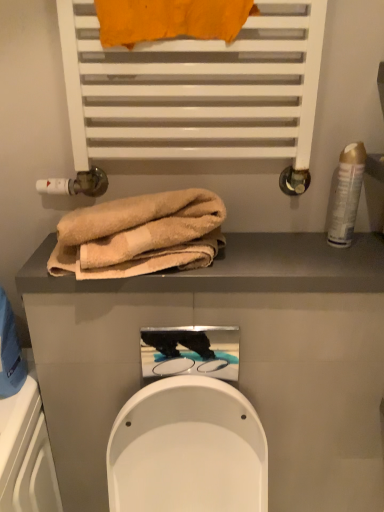
Question: From the image's perspective, does beige towel at upper center appear higher than gold metallic can at right?

Choices:
 (A) no
 (B) yes

Answer: (A)

Question: Considering the relative sizes of beige towel at upper center and gold metallic can at right in the image provided, is beige towel at upper center wider than gold metallic can at right?

Choices:
 (A) no
 (B) yes

Answer: (B)

Question: Is beige towel at upper center outside of gold metallic can at right?

Choices:
 (A) no
 (B) yes

Answer: (B)

Question: Is beige towel at upper center aimed at gold metallic can at right?

Choices:
 (A) yes
 (B) no

Answer: (B)

Question: Is beige towel at upper center bigger than gold metallic can at right?

Choices:
 (A) no
 (B) yes

Answer: (B)

Question: From a real-world perspective, does beige towel at upper center stand above gold metallic can at right?

Choices:
 (A) no
 (B) yes

Answer: (A)

Question: Considering the relative sizes of beige towel at upper center and beige soft towel at center, the 2th towel when ordered from top to bottom, in the image provided, is beige towel at upper center smaller than beige soft towel at center, the 2th towel when ordered from top to bottom,?

Choices:
 (A) no
 (B) yes

Answer: (B)

Question: Is beige towel at upper center further to the viewer compared to beige soft towel at center, the 2th towel when ordered from top to bottom?

Choices:
 (A) yes
 (B) no

Answer: (A)

Question: From a real-world perspective, is beige towel at upper center below beige soft towel at center, the 2th towel when ordered from top to bottom?

Choices:
 (A) no
 (B) yes

Answer: (B)

Question: Does beige towel at upper center have a lesser width compared to beige soft towel at center, the 2th towel when ordered from top to bottom?

Choices:
 (A) yes
 (B) no

Answer: (B)

Question: Are beige towel at upper center and beige soft towel at center, the 2th towel when ordered from top to bottom, beside each other?

Choices:
 (A) yes
 (B) no

Answer: (B)

Question: Is beige towel at upper center to the left of beige soft towel at center, the 2th towel when ordered from top to bottom, from the viewer's perspective?

Choices:
 (A) yes
 (B) no

Answer: (B)

Question: Does orange fabric towel at upper center, marked as the first towel in a top-to-bottom arrangement, have a smaller size compared to beige towel at upper center?

Choices:
 (A) no
 (B) yes

Answer: (B)